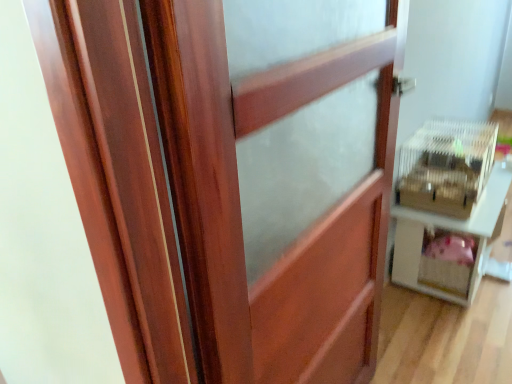
Question: Choose the correct answer: Is clear plastic crate at right inside white plastic cage at right or outside it?

Choices:
 (A) outside
 (B) inside

Answer: (A)

Question: From their relative heights in the image, would you say clear plastic crate at right is taller or shorter than white plastic cage at right?

Choices:
 (A) short
 (B) tall

Answer: (A)

Question: Estimate the real-world distances between objects in this image. Which object is closer to the white plastic cage at right?

Choices:
 (A) wooden barn door at center
 (B) clear plastic crate at right

Answer: (B)

Question: Which object is the farthest from the white plastic cage at right?

Choices:
 (A) clear plastic crate at right
 (B) wooden barn door at center

Answer: (B)